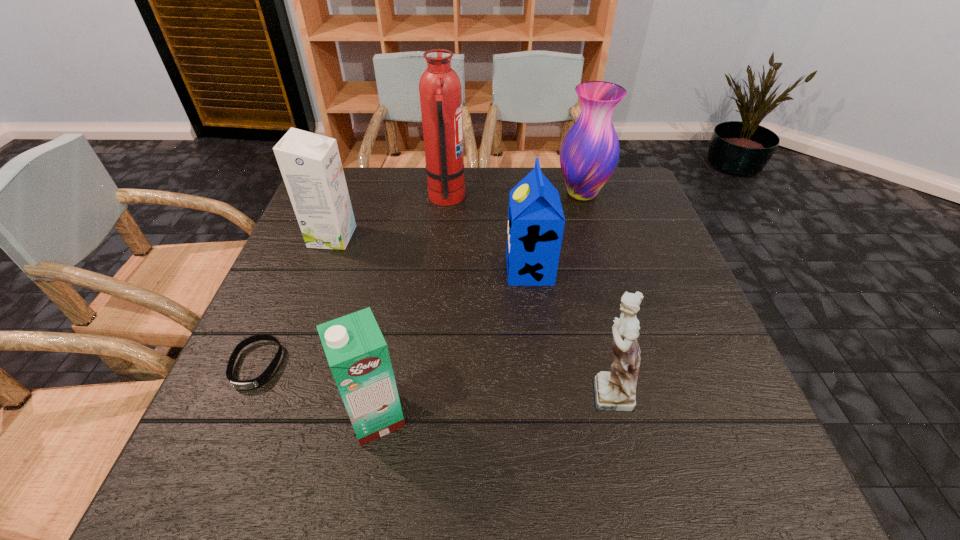
At what (x,y) coordinates should I click in order to perform the action: click on vacant region located 0.150m on the left of the vase. Please return your answer as a coordinate pair (x, y). Looking at the image, I should click on (504, 193).

This screenshot has height=540, width=960. In order to click on blank area located on the right of the leftmost carton in this screenshot , I will do `click(468, 237)`.

Identify the location of free region located 0.170m with the cap open on the rightmost carton. The image size is (960, 540). (437, 269).

Identify the location of free location located with the cap open on the rightmost carton. The width and height of the screenshot is (960, 540). click(420, 269).

You are a GUI agent. You are given a task and a screenshot of the screen. Output one action in this format:
    pyautogui.click(x=<x>, y=<y>)
    Task: Click on the free space located with the cap open on the rightmost carton
    Image resolution: width=960 pixels, height=540 pixels.
    Given the screenshot: What is the action you would take?
    pyautogui.click(x=432, y=269)

Where is `free location located 0.090m on the front-facing side of the figurine`? The height and width of the screenshot is (540, 960). free location located 0.090m on the front-facing side of the figurine is located at coordinates (530, 390).

Locate an element on the screen. The image size is (960, 540). vacant position located on the front-facing side of the figurine is located at coordinates (514, 390).

Identify the location of vacant space located 0.290m on the front-facing side of the figurine. Image resolution: width=960 pixels, height=540 pixels. (423, 390).

Identify the location of vacant space located on the right of the second carton from left to right. (574, 417).

Locate an element on the screen. free location located 0.090m on the display of the shortest object is located at coordinates (226, 437).